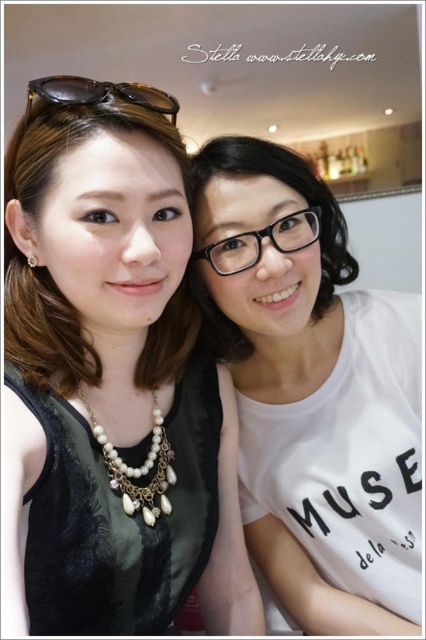
You are a photographer standing 1 meter away from the camera. You want to take a photo of the matte black dress at left. Can you move closer to the dress without moving the camera?

The distance between the matte black dress at left and the camera is 41.14 centimeters. Since you are currently 1 meter away from the camera, you can move closer to the dress as long as you stay within the 41.14 cm distance from the camera to avoid being in the frame.